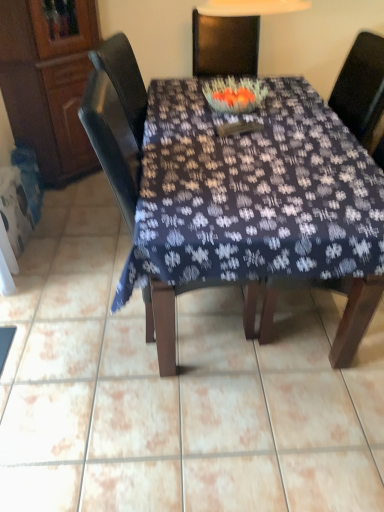
You are a GUI agent. You are given a task and a screenshot of the screen. Output one action in this format:
    pyautogui.click(x=<x>, y=<y>)
    Task: Click on the vacant area that is in front of matte dark wood chair at center, the second chair from the right
    
    Given the screenshot: What is the action you would take?
    pyautogui.click(x=185, y=404)